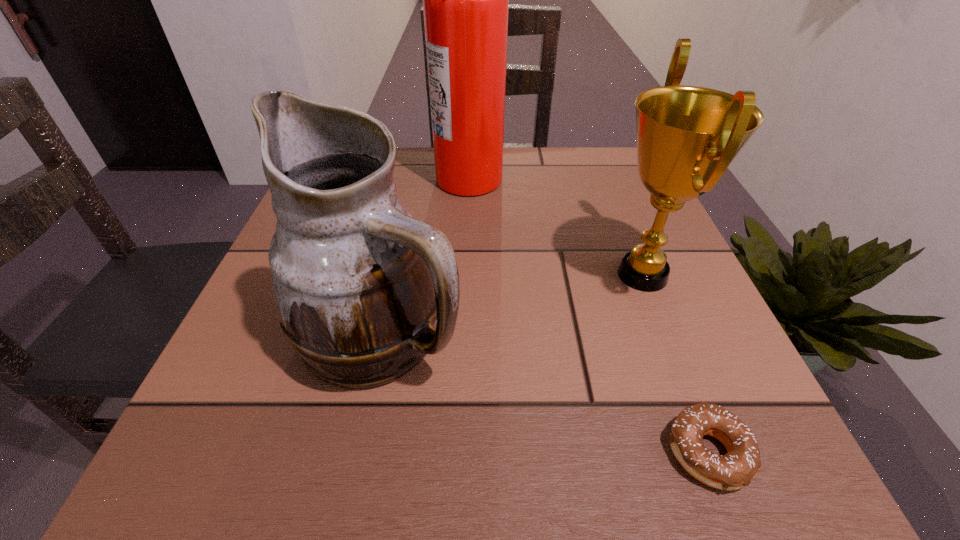
You are a GUI agent. You are given a task and a screenshot of the screen. Output one action in this format:
    pyautogui.click(x=<x>, y=<y>)
    Task: Click on the free space between the award and the pitcher
    The image size is (960, 540).
    Given the screenshot: What is the action you would take?
    pyautogui.click(x=512, y=305)

Locate which object is the third closest to the award. Please provide its 2D coordinates. Your answer should be formatted as a tuple, i.e. [(x, y)], where the tuple contains the x and y coordinates of a point satisfying the conditions above.

[(358, 282)]

Identify which object is the third closest to the farthest object. Please provide its 2D coordinates. Your answer should be formatted as a tuple, i.e. [(x, y)], where the tuple contains the x and y coordinates of a point satisfying the conditions above.

[(735, 469)]

This screenshot has height=540, width=960. Identify the location of vacant space that satisfies the following two spatial constraints: 1. from the spout of the pitcher; 2. on the left side of the nearest object. (356, 453).

The image size is (960, 540). I want to click on free spot that satisfies the following two spatial constraints: 1. from the spout of the pitcher; 2. on the back side of the nearest object, so click(356, 453).

The width and height of the screenshot is (960, 540). What are the coordinates of `free space that satisfies the following two spatial constraints: 1. at the nozzle of the farthest object; 2. on the left side of the doughnut` in the screenshot? It's located at (460, 453).

Identify the location of free space that satisfies the following two spatial constraints: 1. from the spout of the doughnut; 2. on the right side of the pitcher. (356, 453).

This screenshot has height=540, width=960. In order to click on blank space that satisfies the following two spatial constraints: 1. from the spout of the shortest object; 2. on the left side of the pitcher in this screenshot , I will do `click(356, 453)`.

Identify the location of free space that satisfies the following two spatial constraints: 1. at the nozzle of the shortest object; 2. on the left side of the tallest object. This screenshot has width=960, height=540. (460, 453).

Identify the location of vacant region that satisfies the following two spatial constraints: 1. from the spout of the pitcher; 2. on the right side of the doughnut. The width and height of the screenshot is (960, 540). (356, 453).